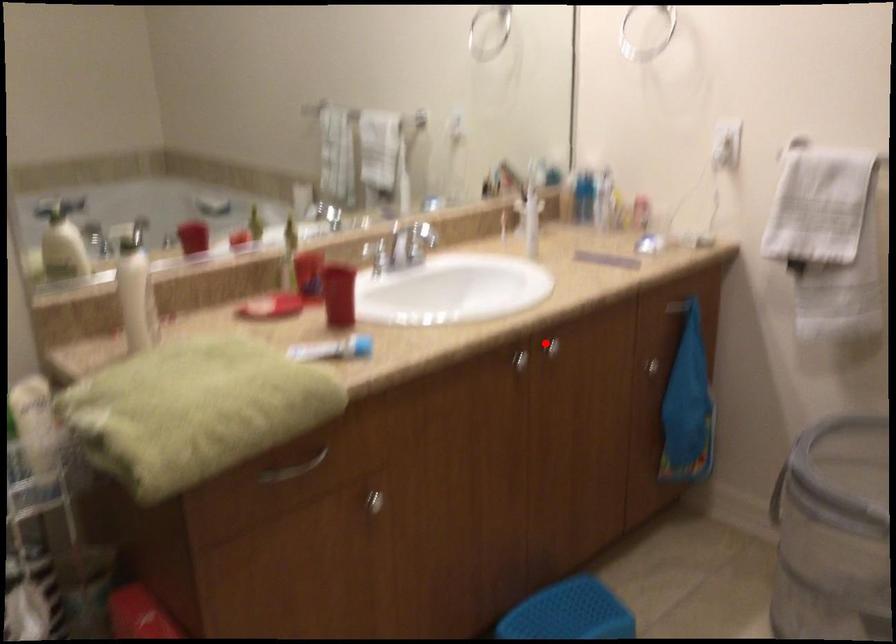
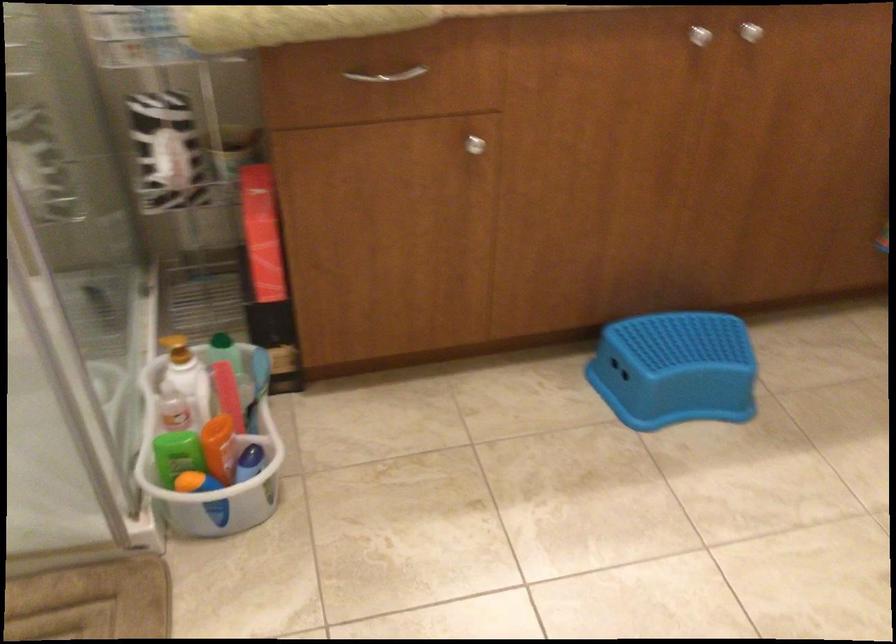
Question: I am providing you with two images of the same scene from different viewpoints. Given a red point in image1, look at the same physical point in image2. Is it:

Choices:
 (A) Closer to the viewpoint
 (B) Farther from the viewpoint

Answer: (A)